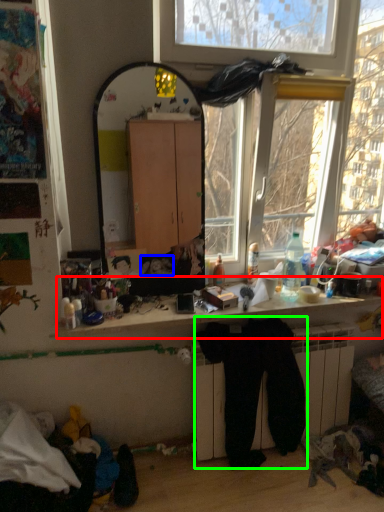
Question: Considering the real-world distances, which object is closest to computer desk (highlighted by a red box)? person (highlighted by a blue box) or clothing (highlighted by a green box).

Choices:
 (A) person
 (B) clothing

Answer: (B)